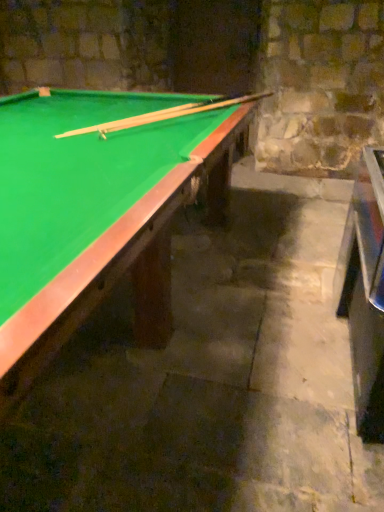
Question: Can you confirm if green felt billiard table at upper left is wider than wooden cue at upper center?

Choices:
 (A) yes
 (B) no

Answer: (A)

Question: Is green felt billiard table at upper left not within wooden cue at upper center?

Choices:
 (A) no
 (B) yes

Answer: (B)

Question: Can you confirm if green felt billiard table at upper left is smaller than wooden cue at upper center?

Choices:
 (A) yes
 (B) no

Answer: (B)

Question: Are green felt billiard table at upper left and wooden cue at upper center located far from each other?

Choices:
 (A) no
 (B) yes

Answer: (A)

Question: From the image's perspective, is green felt billiard table at upper left below wooden cue at upper center?

Choices:
 (A) no
 (B) yes

Answer: (B)

Question: From a real-world perspective, is metallic silver table at right positioned above or below wooden cue at upper center?

Choices:
 (A) below
 (B) above

Answer: (A)

Question: Is point pyautogui.click(x=357, y=205) positioned closer to the camera than point pyautogui.click(x=220, y=108)?

Choices:
 (A) closer
 (B) farther

Answer: (A)

Question: Considering their positions, is metallic silver table at right located in front of or behind wooden cue at upper center?

Choices:
 (A) behind
 (B) front

Answer: (B)

Question: Is metallic silver table at right taller or shorter than wooden cue at upper center?

Choices:
 (A) short
 (B) tall

Answer: (B)

Question: Is point (72, 134) closer or farther from the camera than point (365, 169)?

Choices:
 (A) closer
 (B) farther

Answer: (B)

Question: Is wooden cue at upper center spatially inside metallic silver table at right, or outside of it?

Choices:
 (A) outside
 (B) inside

Answer: (A)

Question: From a real-world perspective, is wooden cue at upper center above or below metallic silver table at right?

Choices:
 (A) below
 (B) above

Answer: (B)

Question: Considering the relative positions of wooden cue at upper center and metallic silver table at right in the image provided, is wooden cue at upper center to the left or to the right of metallic silver table at right?

Choices:
 (A) left
 (B) right

Answer: (A)

Question: Is green felt billiard table at upper left inside the boundaries of wooden cue at upper center, or outside?

Choices:
 (A) inside
 (B) outside

Answer: (B)

Question: Considering the positions of green felt billiard table at upper left and wooden cue at upper center in the image, is green felt billiard table at upper left wider or thinner than wooden cue at upper center?

Choices:
 (A) thin
 (B) wide

Answer: (B)